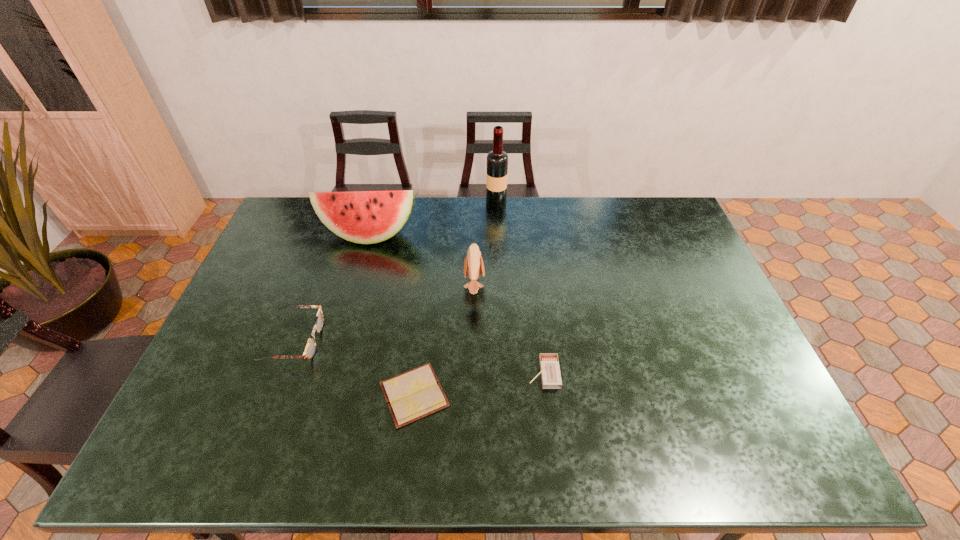
What are the coordinates of `the farthest object` in the screenshot? It's located at (497, 160).

The height and width of the screenshot is (540, 960). I want to click on the fifth object from left to right, so click(497, 160).

In order to click on the fifth shortest object in this screenshot , I will do `click(366, 217)`.

Where is `watermelon`? watermelon is located at coordinates (366, 217).

The image size is (960, 540). I want to click on bird, so click(473, 264).

Where is `the fourth nearest object`? the fourth nearest object is located at coordinates (473, 264).

What are the coordinates of `spectacles` in the screenshot? It's located at (310, 349).

Identify the location of matchbox. (549, 364).

Identify the location of the fifth tallest object. (549, 364).

This screenshot has width=960, height=540. Identify the location of diary. (412, 395).